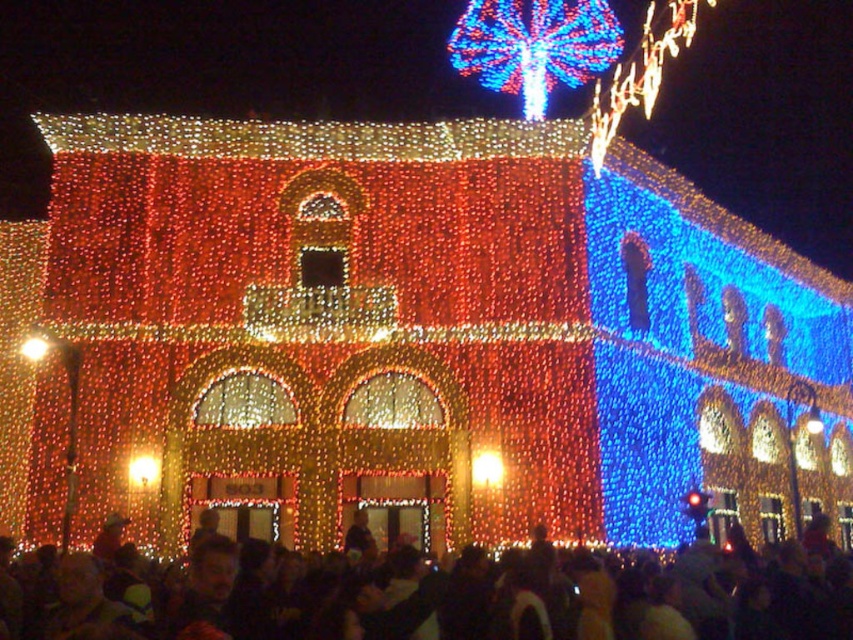
Question: Is matte gold light at center smaller than matte gold light at lower left?

Choices:
 (A) no
 (B) yes

Answer: (B)

Question: Which point is closer to the camera taking this photo?

Choices:
 (A) (816, 529)
 (B) (32, 337)

Answer: (B)

Question: Which point is farther to the camera?

Choices:
 (A) black matte crowd at lower center
 (B) matte gold light at lower left
 (C) illuminated string lights at center
 (D) matte gold light at center

Answer: (B)

Question: Is illuminated string lights at center above matte gold light at lower left?

Choices:
 (A) yes
 (B) no

Answer: (B)

Question: Which object is farther from the camera taking this photo?

Choices:
 (A) matte gold light at center
 (B) black matte crowd at lower center
 (C) illuminated string lights at center

Answer: (C)

Question: Is black matte crowd at lower center closer to camera compared to matte gold light at center?

Choices:
 (A) yes
 (B) no

Answer: (A)